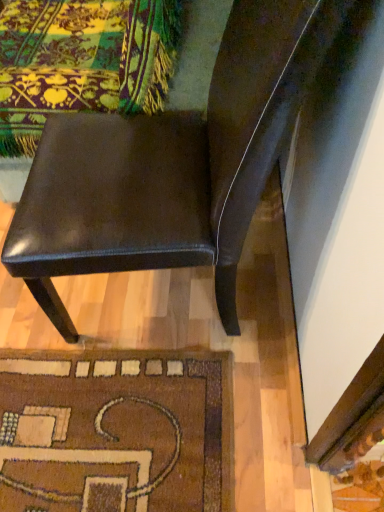
Image resolution: width=384 pixels, height=512 pixels. What do you see at coordinates (173, 164) in the screenshot?
I see `black leather chair at center` at bounding box center [173, 164].

Where is `black leather chair at center`? This screenshot has height=512, width=384. black leather chair at center is located at coordinates (173, 164).

This screenshot has width=384, height=512. I want to click on black leather chair at center, so click(x=173, y=164).